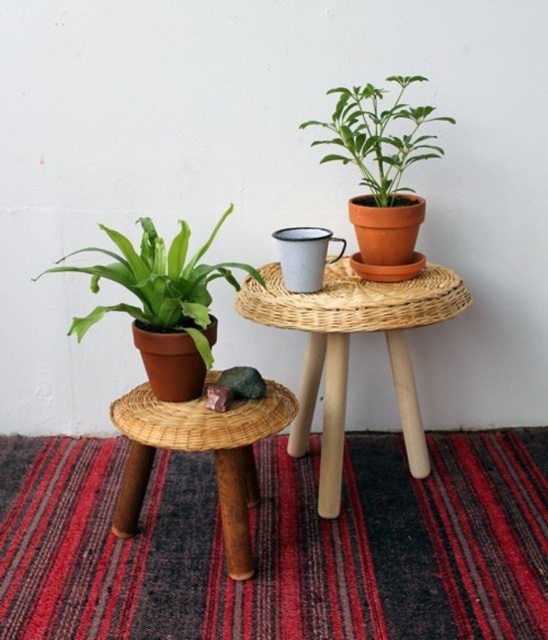
Who is more forward, (x=392, y=323) or (x=286, y=426)?

Point (x=286, y=426) is in front.

Does woven wood table at center appear on the right side of rattan stool at lower left?

Indeed, woven wood table at center is positioned on the right side of rattan stool at lower left.

Is point (323, 356) closer to camera compared to point (256, 493)?

No.

Image resolution: width=548 pixels, height=640 pixels. I want to click on woven wood table at center, so click(347, 349).

Can you confirm if rug with woven texture at lower center is positioned above woven wood table at center?

No, rug with woven texture at lower center is not above woven wood table at center.

Is point (448, 506) closer to viewer compared to point (401, 388)?

Yes, point (448, 506) is closer to viewer.

The height and width of the screenshot is (640, 548). Find the location of `rug with woven texture at lower center`. rug with woven texture at lower center is located at coordinates (282, 545).

Who is more forward, (385, 614) or (399, 186)?

Positioned in front is point (385, 614).

Which is behind, point (261, 584) or point (392, 145)?

Positioned behind is point (392, 145).

You are a GUI agent. You are given a task and a screenshot of the screen. Output one action in this format:
    pyautogui.click(x=<x>, y=<y>)
    Task: Click on the rug with woven texture at lower center
    This screenshot has height=640, width=548.
    Given the screenshot: What is the action you would take?
    pyautogui.click(x=282, y=545)